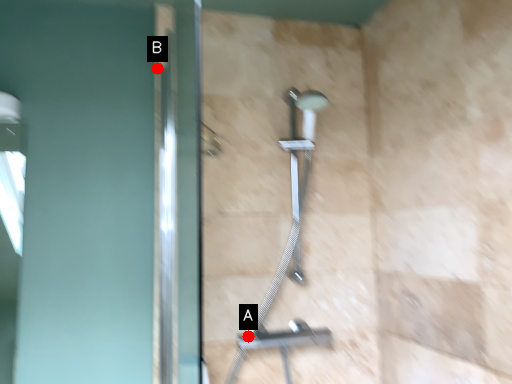
Question: Two points are circled on the image, labeled by A and B beside each circle. Which point is closer to the camera?

Choices:
 (A) A is closer
 (B) B is closer

Answer: (A)